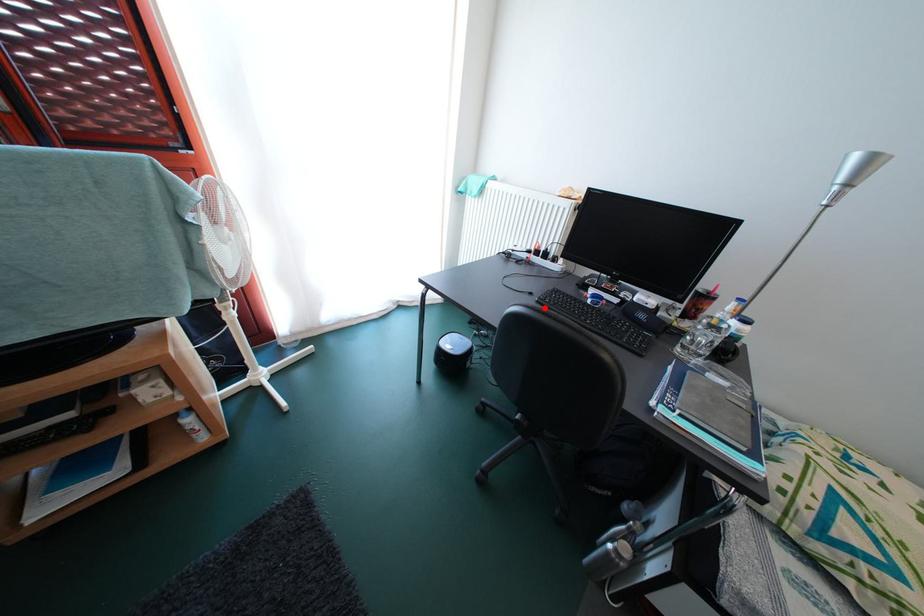
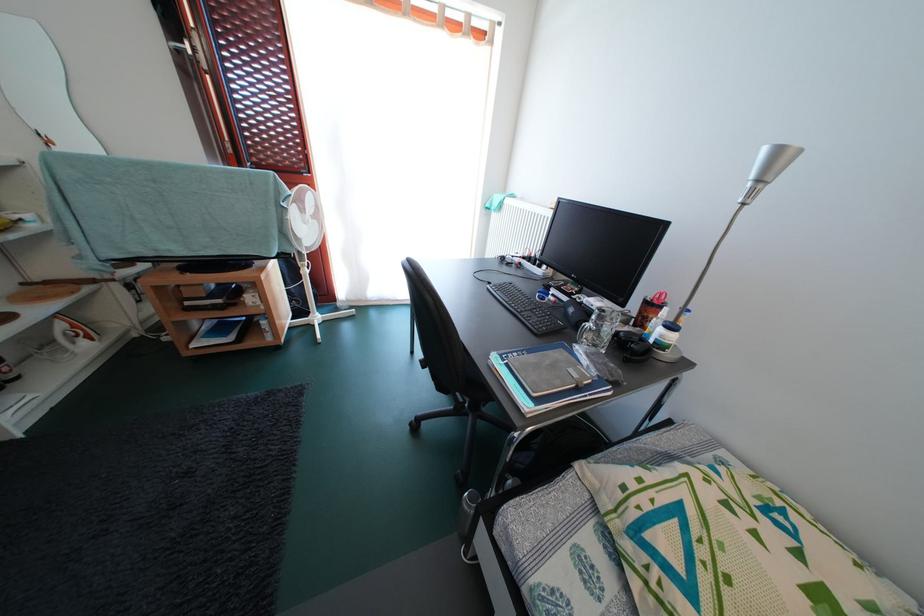
Question: A red point is marked in image1. In image2, is the corresponding 3D point closer to the camera or farther? Reply with the corresponding letter.

Choices:
 (A) The corresponding 3D point is closer.
 (B) The corresponding 3D point is farther.

Answer: (A)